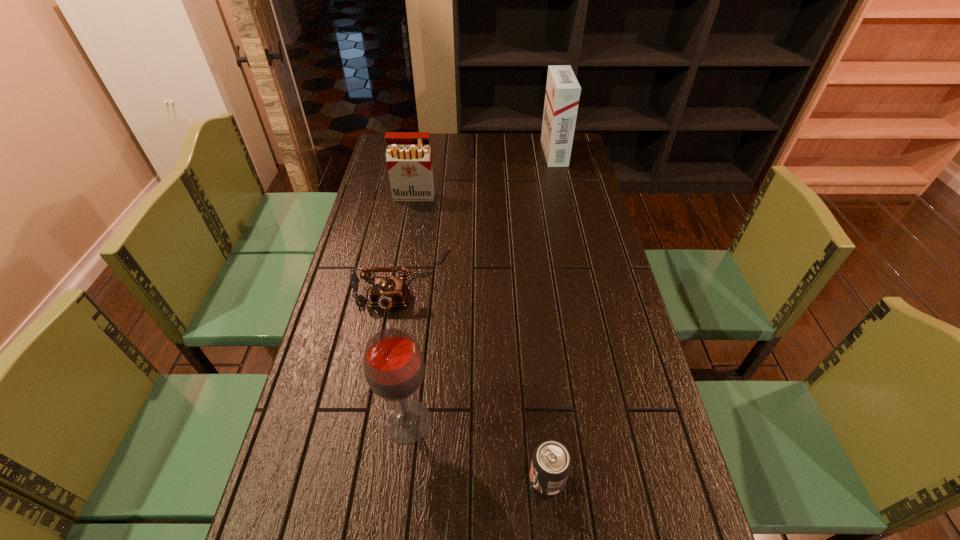
The width and height of the screenshot is (960, 540). I want to click on vacant area situated 0.140m on the back of the alcohol, so pos(417,350).

The height and width of the screenshot is (540, 960). What are the coordinates of `free space located 0.350m with the lid open on the shorter cigarette case` in the screenshot? It's located at (401, 267).

Find the location of a particular element. vacant space located on the dial of the telephone is located at coordinates (376, 437).

Find the location of a particular element. vacant point located on the back of the soda can is located at coordinates (533, 335).

The image size is (960, 540). Find the location of `object that is at the far edge`. object that is at the far edge is located at coordinates click(x=563, y=90).

Where is `cigarette case present at the left edge`? cigarette case present at the left edge is located at coordinates (408, 155).

Where is `telephone that is at the left edge`? The image size is (960, 540). telephone that is at the left edge is located at coordinates (385, 292).

Locate an element on the screen. This screenshot has height=540, width=960. object situated at the right edge is located at coordinates (563, 90).

Locate an element on the screen. object at the far right corner is located at coordinates (563, 90).

Where is `vacant space at the far edge of the desktop`? The height and width of the screenshot is (540, 960). vacant space at the far edge of the desktop is located at coordinates (536, 148).